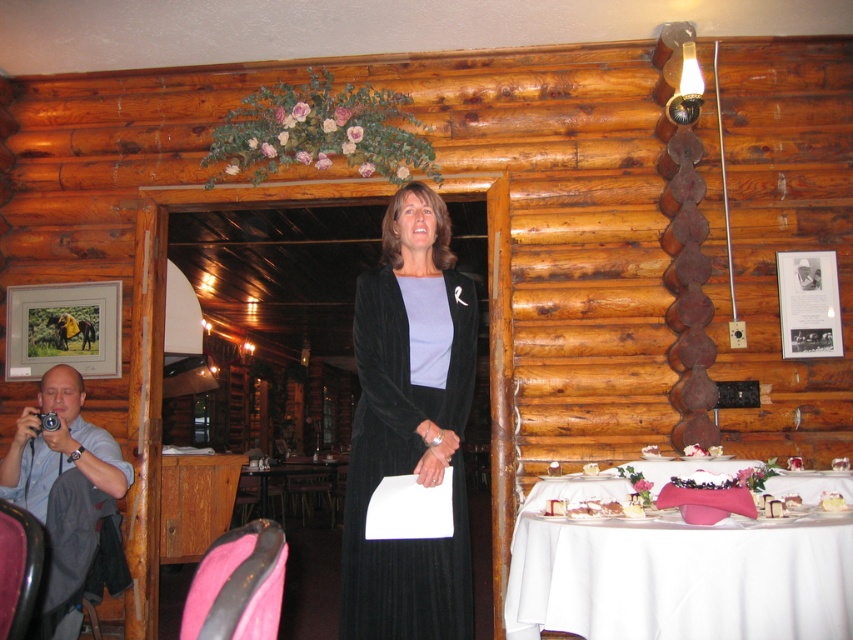
Question: Considering the real-world distances, which object is farthest from the white cloth table at lower right?

Choices:
 (A) black velvet dress at center
 (B) blue shirt at left

Answer: (B)

Question: Among these objects, which one is nearest to the camera?

Choices:
 (A) white cloth table at lower right
 (B) blue shirt at left

Answer: (A)

Question: Estimate the real-world distances between objects in this image. Which object is closer to the white cloth table at lower right?

Choices:
 (A) blue shirt at left
 (B) black velvet dress at center

Answer: (B)

Question: Is white cloth table at lower right thinner than black velvet dress at center?

Choices:
 (A) no
 (B) yes

Answer: (A)

Question: Is black velvet dress at center in front of blue shirt at left?

Choices:
 (A) yes
 (B) no

Answer: (A)

Question: Is the position of black velvet dress at center less distant than that of blue shirt at left?

Choices:
 (A) no
 (B) yes

Answer: (B)